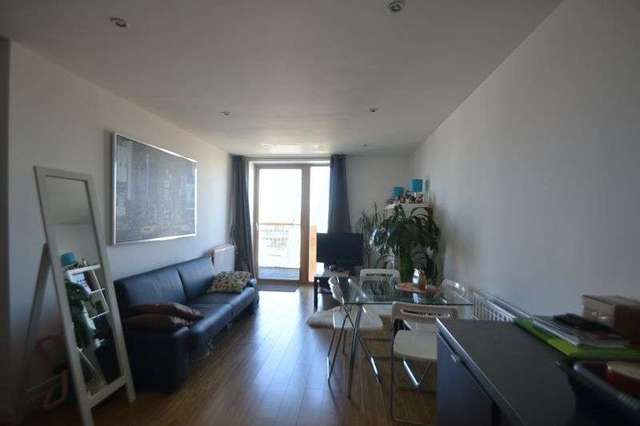
Identify the location of ceiling. (227, 6), (296, 111).